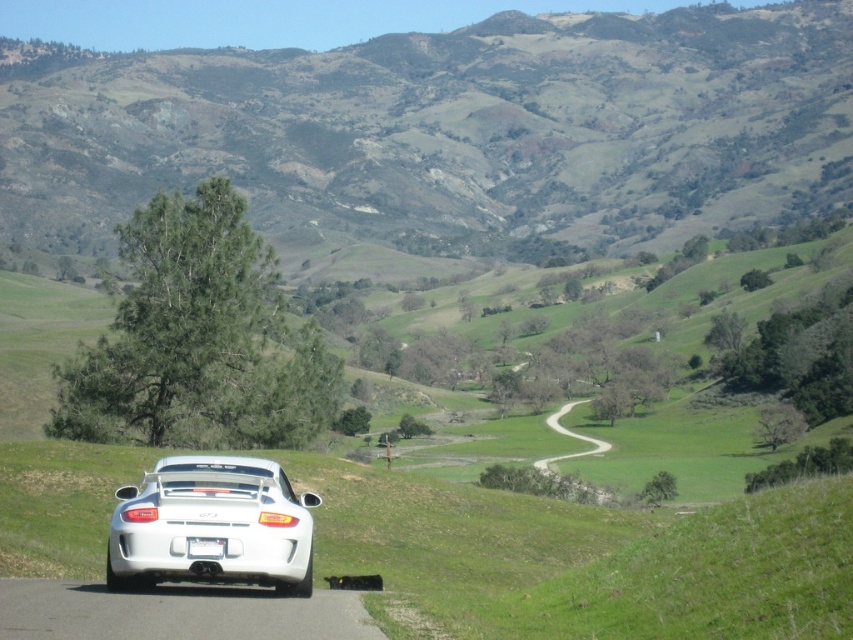
Is point (392, 90) less distant than point (567, 433)?

No.

In the scene shown: Is green grassy hillside at upper center positioned behind gravel dirt road at center?

Yes, green grassy hillside at upper center is behind gravel dirt road at center.

The height and width of the screenshot is (640, 853). What do you see at coordinates (450, 131) in the screenshot? I see `green grassy hillside at upper center` at bounding box center [450, 131].

Locate an element on the screen. green grassy hillside at upper center is located at coordinates (450, 131).

Who is lower down, white glossy car at lower center or gravel dirt road at center?

gravel dirt road at center

Between white glossy car at lower center and gravel dirt road at center, which one appears on the left side from the viewer's perspective?

white glossy car at lower center

Find the location of a particular element. The image size is (853, 640). white glossy car at lower center is located at coordinates (212, 525).

Between point (573, 401) and point (190, 538), which one is positioned behind?

Point (573, 401)

Between gravel dirt road at center and white plastic license plate at center, which one appears on the right side from the viewer's perspective?

gravel dirt road at center

You are a GUI agent. You are given a task and a screenshot of the screen. Output one action in this format:
    pyautogui.click(x=<x>, y=<y>)
    Task: Click on the gravel dirt road at center
    
    Given the screenshot: What is the action you would take?
    pyautogui.click(x=569, y=436)

Where is `gravel dirt road at center`? gravel dirt road at center is located at coordinates (569, 436).